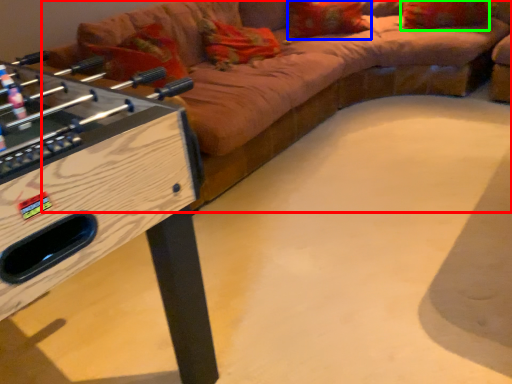
Question: Considering the real-world distances, which object is closest to studio couch (highlighted by a red box)? pillow (highlighted by a blue box) or pillow (highlighted by a green box).

Choices:
 (A) pillow
 (B) pillow

Answer: (A)